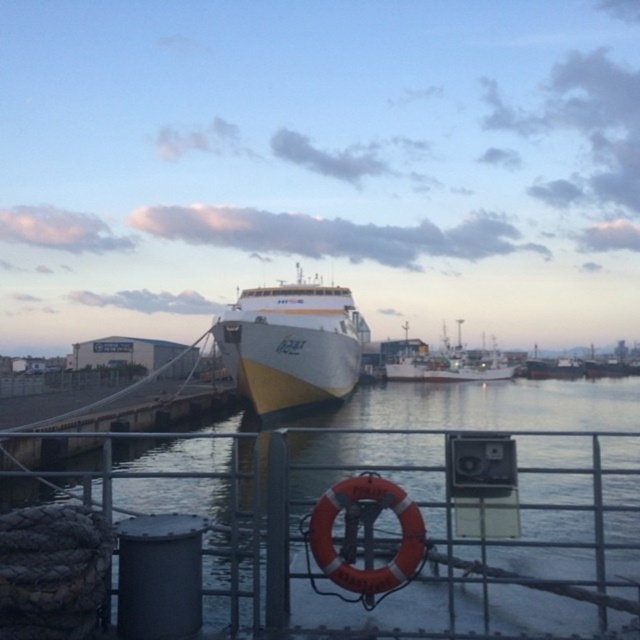
What are the coordinates of the white glossy ferry at center?

The white glossy ferry at center is located at coordinates point (291, 342).

Consider the image. What is the location of the point with coordinates (291,342) in the harbor scene?

The point with coordinates (291,342) is located on the white glossy ferry at center.